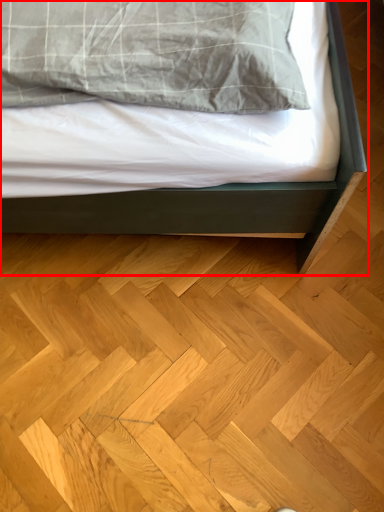
Question: From the image's perspective, where is bed (annotated by the red box) located relative to hardwood?

Choices:
 (A) below
 (B) above

Answer: (B)